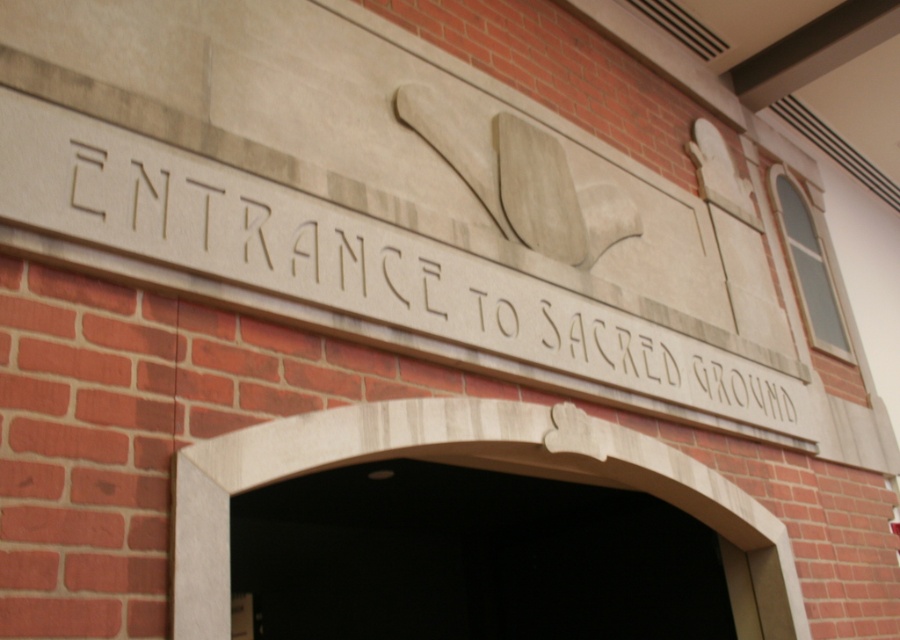
Question: Which point is closer to the camera taking this photo?

Choices:
 (A) (771, 556)
 (B) (308, 230)

Answer: (B)

Question: Can you confirm if carved stone sign at center is positioned below smooth stone arch at center?

Choices:
 (A) yes
 (B) no

Answer: (B)

Question: Among these points, which one is farthest from the camera?

Choices:
 (A) (304, 216)
 (B) (212, 577)

Answer: (A)

Question: Which point is farther to the camera?

Choices:
 (A) (310, 260)
 (B) (173, 490)

Answer: (A)

Question: Can you confirm if carved stone sign at center is smaller than smooth stone arch at center?

Choices:
 (A) no
 (B) yes

Answer: (A)

Question: Is carved stone sign at center above smooth stone arch at center?

Choices:
 (A) yes
 (B) no

Answer: (A)